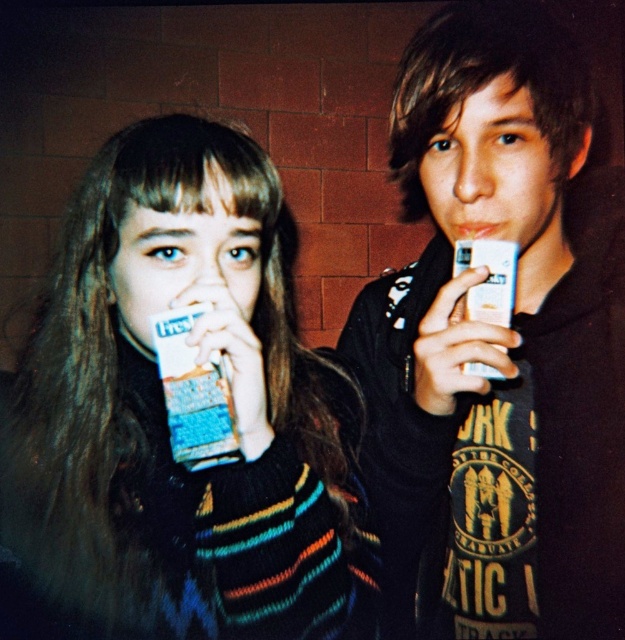
Between matte black phone at right and matte white teeth at upper center, which one has less height?

With less height is matte white teeth at upper center.

Is point (518, 115) more distant than point (485, 227)?

No, it is not.

Image resolution: width=625 pixels, height=640 pixels. I want to click on matte black phone at right, so click(x=512, y=328).

Can you confirm if knitted sweater at left is smaller than matte white teeth at upper center?

No.

Is point (126, 596) more distant than point (501, 230)?

No, it is not.

Which is behind, point (132, 385) or point (471, 224)?

The point (132, 385) is behind.

Find the location of a particular element. knitted sweater at left is located at coordinates (166, 422).

Is knitted sweater at left positioned behind matte black phone at right?

No, knitted sweater at left is in front of matte black phone at right.

Can you confirm if knitted sweater at left is shorter than matte black phone at right?

Correct, knitted sweater at left is not as tall as matte black phone at right.

What do you see at coordinates (166, 422) in the screenshot?
I see `knitted sweater at left` at bounding box center [166, 422].

Locate an element on the screen. The image size is (625, 640). knitted sweater at left is located at coordinates (166, 422).